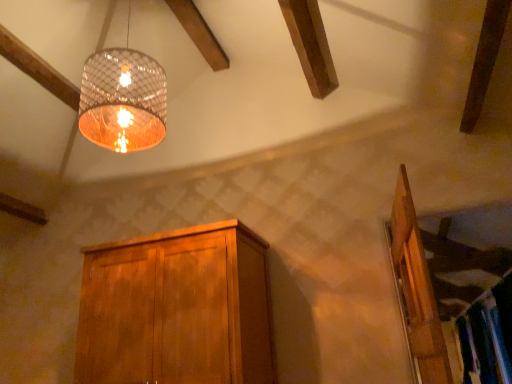
I want to click on translucent glass lampshade at upper center, so click(123, 99).

This screenshot has height=384, width=512. What are the coordinates of `wooden door at right` in the screenshot? It's located at (416, 290).

I want to click on translucent glass lampshade at upper center, so click(x=123, y=99).

Based on the photo, which of these two, wooden cabinet at center or translucent glass lampshade at upper center, is thinner?

translucent glass lampshade at upper center.

How different are the orientations of wooden cabinet at center and translucent glass lampshade at upper center in degrees?

There is a 2.42-degree angle between the facing directions of wooden cabinet at center and translucent glass lampshade at upper center.

From the image's perspective, which one is positioned higher, wooden cabinet at center or translucent glass lampshade at upper center?

translucent glass lampshade at upper center.

Can you confirm if wooden cabinet at center is shorter than translucent glass lampshade at upper center?

Yes.

From their relative heights in the image, would you say wooden door at right is taller or shorter than translucent glass lampshade at upper center?

Clearly, wooden door at right is shorter compared to translucent glass lampshade at upper center.

Which of these two, wooden door at right or translucent glass lampshade at upper center, is smaller?

Smaller between the two is wooden door at right.

Consider the image. From the image's perspective, which object appears higher, wooden door at right or translucent glass lampshade at upper center?

translucent glass lampshade at upper center.

From a real-world perspective, is wooden door at right over translucent glass lampshade at upper center?

Actually, wooden door at right is physically below translucent glass lampshade at upper center in the real world.

In the scene shown: Can you tell me how much translucent glass lampshade at upper center and wooden door at right differ in facing direction?

84.3 degrees separate the facing orientations of translucent glass lampshade at upper center and wooden door at right.

Where is `lamp above the wooden door at right (from the image's perspective)`? The image size is (512, 384). lamp above the wooden door at right (from the image's perspective) is located at coordinates (123, 99).

Is translucent glass lampshade at upper center facing towards wooden door at right?

No, translucent glass lampshade at upper center does not turn towards wooden door at right.

Is translucent glass lampshade at upper center beside wooden door at right?

They are not placed beside each other.

Who is more distant, translucent glass lampshade at upper center or wooden cabinet at center?

wooden cabinet at center is further away from the camera.

How different are the orientations of translucent glass lampshade at upper center and wooden cabinet at center in degrees?

The angle between the facing direction of translucent glass lampshade at upper center and the facing direction of wooden cabinet at center is 2.42 degrees.

Which point is more forward, (133, 68) or (86, 280)?

The point (133, 68) is closer to the camera.

Considering the relative sizes of translucent glass lampshade at upper center and wooden cabinet at center in the image provided, is translucent glass lampshade at upper center bigger than wooden cabinet at center?

No.

Is wooden cabinet at center oriented towards wooden door at right?

No, wooden cabinet at center is not aimed at wooden door at right.

Locate an element on the screen. Image resolution: width=512 pixels, height=384 pixels. door located in front of the wooden cabinet at center is located at coordinates (416, 290).

Is wooden cabinet at center smaller than wooden door at right?

No, wooden cabinet at center is not smaller than wooden door at right.

From a real-world perspective, is wooden cabinet at center located higher than wooden door at right?

Yes, from a real-world perspective, wooden cabinet at center is on top of wooden door at right.

From a real-world perspective, is wooden door at right positioned above or below wooden cabinet at center?

wooden door at right is below wooden cabinet at center.

From the image's perspective, which one is positioned higher, wooden door at right or wooden cabinet at center?

wooden door at right, from the image's perspective.

How many degrees apart are the facing directions of wooden door at right and wooden cabinet at center?

They differ by 81.9 degrees in their facing directions.

Is wooden door at right spatially inside wooden cabinet at center, or outside of it?

wooden door at right is not enclosed by wooden cabinet at center.

Locate an element on the screen. This screenshot has height=384, width=512. lamp located in front of the wooden cabinet at center is located at coordinates (123, 99).

Locate an element on the screen. Image resolution: width=512 pixels, height=384 pixels. lamp located above the wooden door at right (from a real-world perspective) is located at coordinates (123, 99).

Looking at the image, which one is located further to wooden cabinet at center, translucent glass lampshade at upper center or wooden door at right?

wooden door at right is positioned further to the anchor wooden cabinet at center.

Considering their positions, is translucent glass lampshade at upper center positioned further to wooden door at right than wooden cabinet at center?

Among the two, translucent glass lampshade at upper center is located further to wooden door at right.

When comparing their distances from translucent glass lampshade at upper center, does wooden door at right or wooden cabinet at center seem further?

wooden door at right lies further to translucent glass lampshade at upper center than the other object.

Consider the image. Based on their spatial positions, is wooden cabinet at center or translucent glass lampshade at upper center further from wooden door at right?

translucent glass lampshade at upper center is positioned further to the anchor wooden door at right.

Which object lies further to the anchor point wooden cabinet at center, wooden door at right or translucent glass lampshade at upper center?

wooden door at right lies further to wooden cabinet at center than the other object.

From the image, which object appears to be farther from translucent glass lampshade at upper center, wooden cabinet at center or wooden door at right?

wooden door at right lies further to translucent glass lampshade at upper center than the other object.

Where is `door between translucent glass lampshade at upper center and wooden cabinet at center from top to bottom`? This screenshot has height=384, width=512. door between translucent glass lampshade at upper center and wooden cabinet at center from top to bottom is located at coordinates (416, 290).